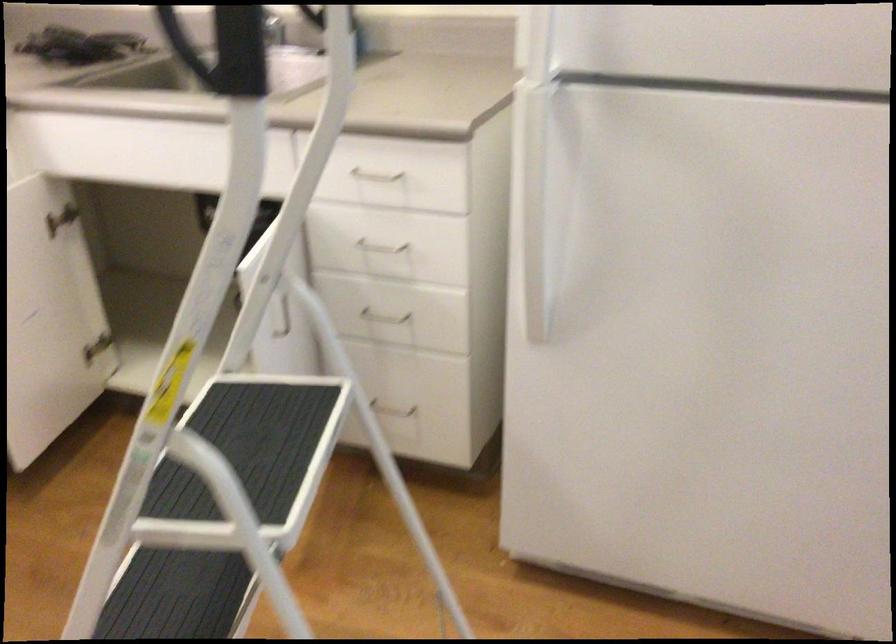
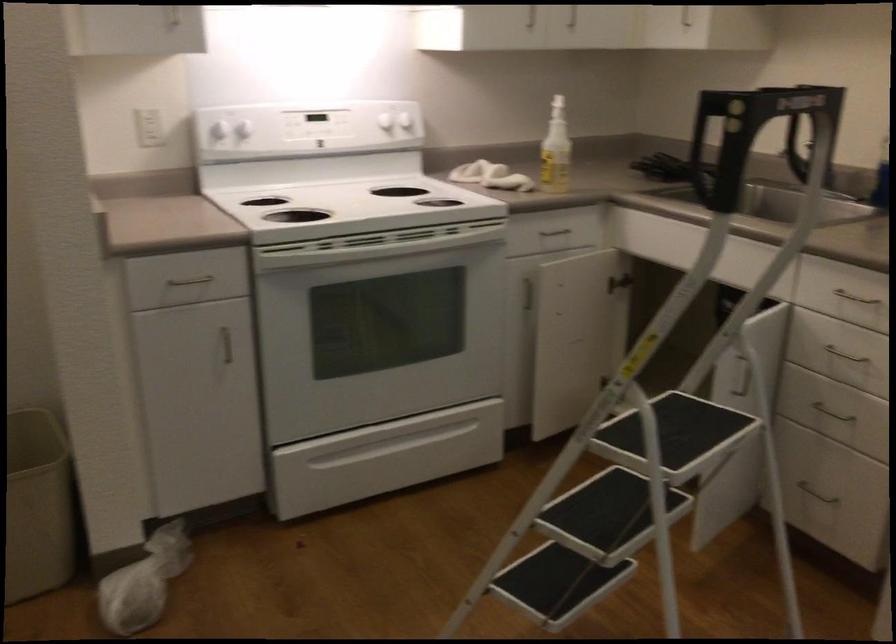
Find the pixel in the second image that matches pixel 226 456 in the first image.

(676, 429)